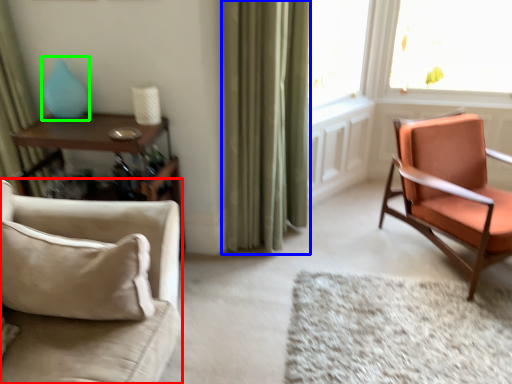
Question: Which object is positioned closest to chair (highlighted by a red box)? Select from curtain (highlighted by a blue box) and turquoise (highlighted by a green box).

Choices:
 (A) curtain
 (B) turquoise

Answer: (B)